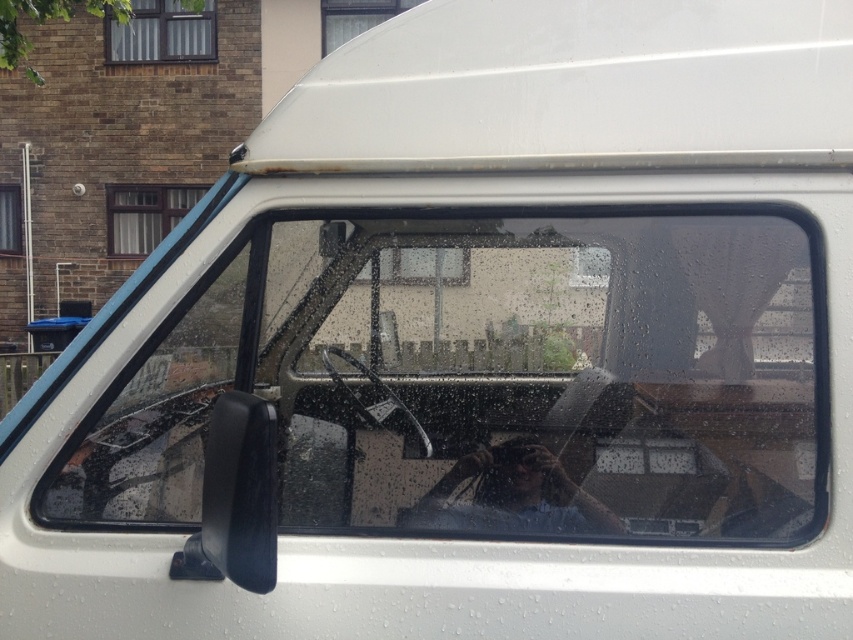
You are a delivery driver who needs to check the GPS on your matte black phone at center while driving. Given the van is parked, can you safely reach the phone without moving from your seat?

The matte black phone at center is located at point coordinates that are within easy reach from the driver seat, so yes, the driver can safely access it without needing to adjust their position.

You are a passenger in the van and want to take a photo using the matte black phone at center. However, the transparent glass window at upper center is reflecting too much light. Can you move the phone closer to the window to reduce the glare?

The matte black phone at center is positioned under the transparent glass window at upper center, so moving it closer would not reduce glare since it is already under the window. Consider adjusting the angle or using a lens hood instead.